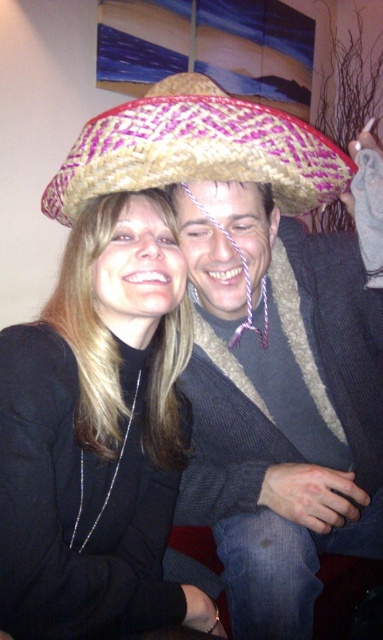
You are standing in front of the image and want to locate the woven straw sombrero at center. According to the coordinates given, where would you find it?

The woven straw sombrero at center is located at coordinates point (x=283, y=394).